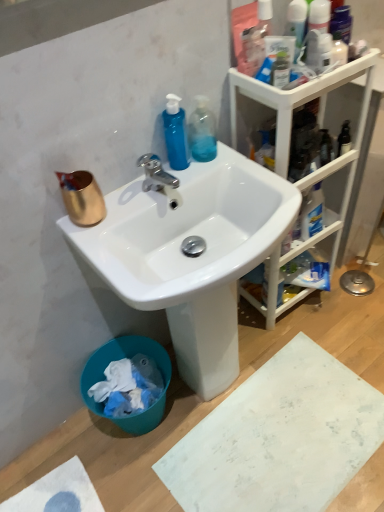
Question: From a real-world perspective, does transparent plastic bottle at upper center, the second cleaning product from the left, sit lower than translucent plastic bottle at upper right?

Choices:
 (A) yes
 (B) no

Answer: (A)

Question: Is transparent plastic bottle at upper center, the second cleaning product from the left, next to translucent plastic bottle at upper right?

Choices:
 (A) yes
 (B) no

Answer: (B)

Question: Is translucent plastic bottle at upper right surrounded by transparent plastic bottle at upper center, the second cleaning product from the left?

Choices:
 (A) yes
 (B) no

Answer: (B)

Question: From the image's perspective, is transparent plastic bottle at upper center, placed as the 1th cleaning product when sorted from right to left, below translucent plastic bottle at upper right?

Choices:
 (A) no
 (B) yes

Answer: (B)

Question: Is the position of transparent plastic bottle at upper center, the second cleaning product from the left, more distant than that of translucent plastic bottle at upper right?

Choices:
 (A) yes
 (B) no

Answer: (A)

Question: Is translucent plastic bottle at upper right in front of or behind transparent plastic bottle at upper center, placed as the 1th cleaning product when sorted from right to left, in the image?

Choices:
 (A) behind
 (B) front

Answer: (B)

Question: Visually, is translucent plastic bottle at upper right positioned to the left or to the right of transparent plastic bottle at upper center, the second cleaning product from the left?

Choices:
 (A) right
 (B) left

Answer: (A)

Question: From the image's perspective, is translucent plastic bottle at upper right above or below transparent plastic bottle at upper center, the second cleaning product from the left?

Choices:
 (A) above
 (B) below

Answer: (A)

Question: In terms of size, does translucent plastic bottle at upper right appear bigger or smaller than transparent plastic bottle at upper center, the second cleaning product from the left?

Choices:
 (A) small
 (B) big

Answer: (A)

Question: Is white plastic cabinet at upper right taller or shorter than transparent plastic bottle at upper center, placed as the 1th cleaning product when sorted from right to left?

Choices:
 (A) tall
 (B) short

Answer: (A)

Question: In terms of size, does white plastic cabinet at upper right appear bigger or smaller than transparent plastic bottle at upper center, placed as the 1th cleaning product when sorted from right to left?

Choices:
 (A) small
 (B) big

Answer: (B)

Question: Is white plastic cabinet at upper right situated inside transparent plastic bottle at upper center, placed as the 1th cleaning product when sorted from right to left, or outside?

Choices:
 (A) inside
 (B) outside

Answer: (B)

Question: In the image, is white plastic cabinet at upper right on the left side or the right side of transparent plastic bottle at upper center, placed as the 1th cleaning product when sorted from right to left?

Choices:
 (A) left
 (B) right

Answer: (B)

Question: From the image's perspective, is white plastic cabinet at upper right above or below teal plastic trash bin at lower left?

Choices:
 (A) above
 (B) below

Answer: (A)

Question: Is white plastic cabinet at upper right to the left or to the right of teal plastic trash bin at lower left in the image?

Choices:
 (A) left
 (B) right

Answer: (B)